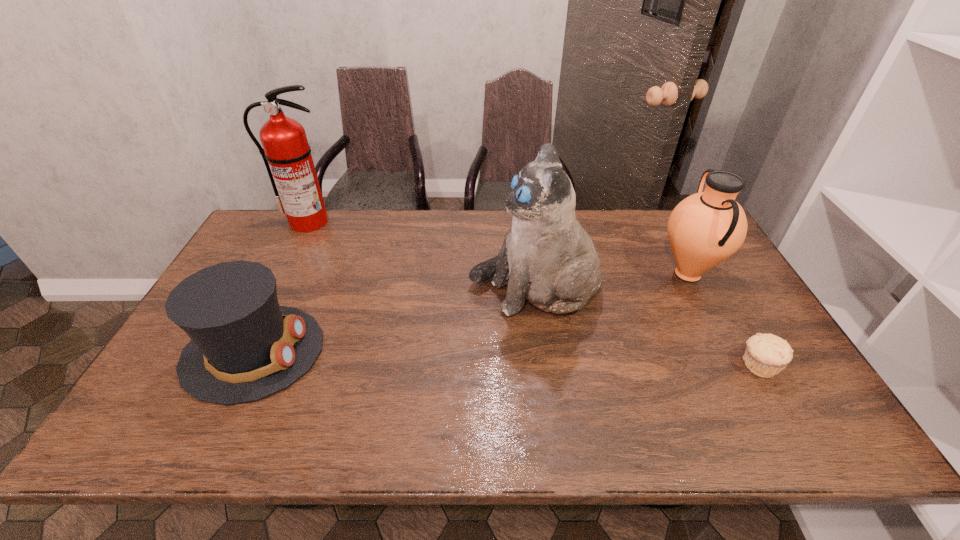
Identify the location of vacant area at the far edge. The image size is (960, 540). (624, 219).

Locate an element on the screen. The height and width of the screenshot is (540, 960). vacant space at the near edge is located at coordinates (372, 434).

Identify the location of vacant region at the far left corner of the desktop. (249, 245).

The height and width of the screenshot is (540, 960). Find the location of `vacant area between the fourth tallest object and the third object from right to left`. vacant area between the fourth tallest object and the third object from right to left is located at coordinates (394, 321).

Find the location of a particular element. Image resolution: width=960 pixels, height=540 pixels. vacant space in between the shortest object and the pitcher is located at coordinates (723, 320).

This screenshot has height=540, width=960. I want to click on vacant area that lies between the fourth tallest object and the third tallest object, so click(470, 313).

Locate an element on the screen. This screenshot has width=960, height=540. empty location between the pitcher and the dress hat is located at coordinates (470, 313).

The width and height of the screenshot is (960, 540). In order to click on empty space that is in between the third shortest object and the third object from right to left in this screenshot , I will do `click(611, 282)`.

Locate an element on the screen. Image resolution: width=960 pixels, height=540 pixels. free spot between the muffin and the second shortest object is located at coordinates (506, 359).

Locate an element on the screen. The width and height of the screenshot is (960, 540). blank region between the third tallest object and the dress hat is located at coordinates (470, 313).